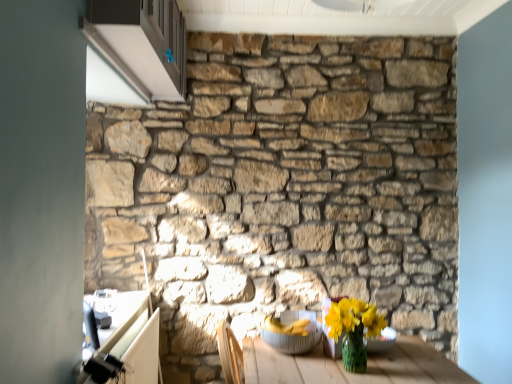
Question: Is the position of translucent glass bowl at lower right, which is the second glass bowl in left-to-right order, less distant than that of white glossy cabinet at upper left?

Choices:
 (A) no
 (B) yes

Answer: (A)

Question: From a real-world perspective, is translucent glass bowl at lower right, which is the second glass bowl in left-to-right order, over white glossy cabinet at upper left?

Choices:
 (A) yes
 (B) no

Answer: (B)

Question: From a real-world perspective, is translucent glass bowl at lower right, which appears as the 1th glass bowl when viewed from the right, located beneath white glossy cabinet at upper left?

Choices:
 (A) yes
 (B) no

Answer: (A)

Question: Does translucent glass bowl at lower right, which is the second glass bowl in left-to-right order, have a greater width compared to white glossy cabinet at upper left?

Choices:
 (A) yes
 (B) no

Answer: (A)

Question: From the image's perspective, is translucent glass bowl at lower right, which appears as the 1th glass bowl when viewed from the right, on white glossy cabinet at upper left?

Choices:
 (A) no
 (B) yes

Answer: (A)

Question: Based on their positions, is metallic silver bowl at lower center, which is counted as the first glass bowl, starting from the left, located to the left or right of white glossy cabinet at upper left?

Choices:
 (A) left
 (B) right

Answer: (B)

Question: From a real-world perspective, is metallic silver bowl at lower center, which is counted as the first glass bowl, starting from the left, positioned above or below white glossy cabinet at upper left?

Choices:
 (A) above
 (B) below

Answer: (B)

Question: From their relative heights in the image, would you say metallic silver bowl at lower center, the 2th glass bowl viewed from the right, is taller or shorter than white glossy cabinet at upper left?

Choices:
 (A) short
 (B) tall

Answer: (A)

Question: From the image's perspective, is metallic silver bowl at lower center, the 2th glass bowl viewed from the right, located above or below white glossy cabinet at upper left?

Choices:
 (A) above
 (B) below

Answer: (B)

Question: Is yellow matte vase at lower right inside or outside of natural stone wall at center?

Choices:
 (A) outside
 (B) inside

Answer: (A)

Question: In the image, is yellow matte vase at lower right on the left side or the right side of natural stone wall at center?

Choices:
 (A) left
 (B) right

Answer: (B)

Question: From a real-world perspective, relative to natural stone wall at center, is yellow matte vase at lower right vertically above or below?

Choices:
 (A) below
 (B) above

Answer: (A)

Question: Is yellow matte vase at lower right bigger or smaller than natural stone wall at center?

Choices:
 (A) small
 (B) big

Answer: (A)

Question: Is natural stone wall at center taller or shorter than metallic silver bowl at lower center, which is counted as the first glass bowl, starting from the left?

Choices:
 (A) tall
 (B) short

Answer: (A)

Question: Is natural stone wall at center situated inside metallic silver bowl at lower center, which is counted as the first glass bowl, starting from the left, or outside?

Choices:
 (A) outside
 (B) inside

Answer: (A)